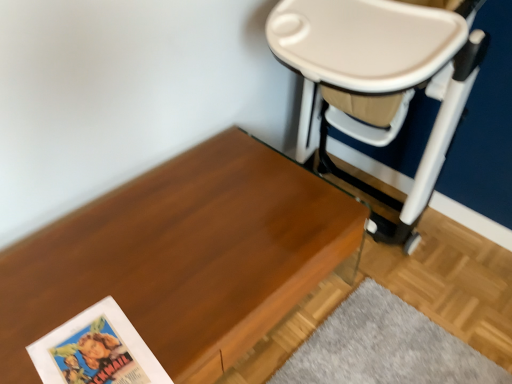
Question: From a real-world perspective, is wooden table at lower left located beneath beige plastic swivel chair at upper right?

Choices:
 (A) yes
 (B) no

Answer: (A)

Question: Does wooden table at lower left have a lesser width compared to beige plastic swivel chair at upper right?

Choices:
 (A) no
 (B) yes

Answer: (A)

Question: Considering the relative sizes of wooden table at lower left and beige plastic swivel chair at upper right in the image provided, is wooden table at lower left taller than beige plastic swivel chair at upper right?

Choices:
 (A) no
 (B) yes

Answer: (A)

Question: Would you say wooden table at lower left is outside beige plastic swivel chair at upper right?

Choices:
 (A) yes
 (B) no

Answer: (A)

Question: Does wooden table at lower left turn towards beige plastic swivel chair at upper right?

Choices:
 (A) no
 (B) yes

Answer: (A)

Question: Can you confirm if wooden table at lower left is positioned to the left of beige plastic swivel chair at upper right?

Choices:
 (A) no
 (B) yes

Answer: (B)

Question: Is beige plastic swivel chair at upper right positioned with its back to matte paper paperback book at lower left?

Choices:
 (A) yes
 (B) no

Answer: (B)

Question: Does beige plastic swivel chair at upper right have a greater height compared to matte paper paperback book at lower left?

Choices:
 (A) yes
 (B) no

Answer: (A)

Question: Are beige plastic swivel chair at upper right and matte paper paperback book at lower left making contact?

Choices:
 (A) no
 (B) yes

Answer: (A)

Question: Can you confirm if beige plastic swivel chair at upper right is shorter than matte paper paperback book at lower left?

Choices:
 (A) no
 (B) yes

Answer: (A)

Question: From a real-world perspective, is beige plastic swivel chair at upper right below matte paper paperback book at lower left?

Choices:
 (A) yes
 (B) no

Answer: (B)

Question: Is the position of beige plastic swivel chair at upper right less distant than that of matte paper paperback book at lower left?

Choices:
 (A) yes
 (B) no

Answer: (A)

Question: Is matte paper paperback book at lower left bigger than wooden table at lower left?

Choices:
 (A) no
 (B) yes

Answer: (A)